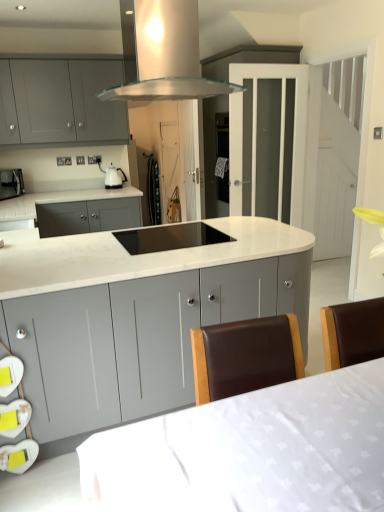
Find the location of `vacant space situated above white glossy kettle at upper left (from a real-world perspective)`. vacant space situated above white glossy kettle at upper left (from a real-world perspective) is located at coordinates (120, 160).